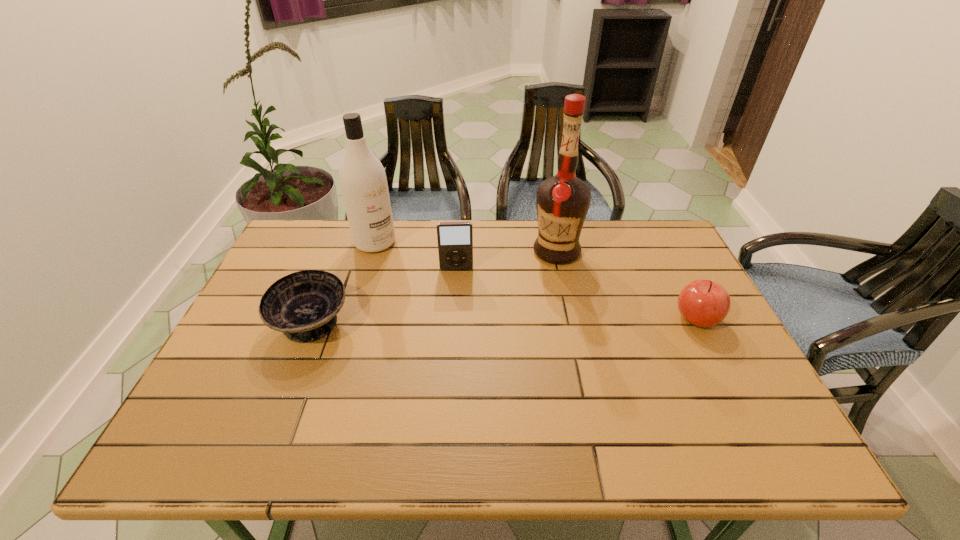
At what (x,y) coordinates should I click in order to perform the action: click on vacant region located on the front and back of the liquor. Please return your answer as a coordinate pair (x, y). The height and width of the screenshot is (540, 960). Looking at the image, I should click on (459, 323).

Identify the location of free space located 0.330m on the front and back of the liquor. This screenshot has width=960, height=540. (464, 319).

Locate an element on the screen. This screenshot has width=960, height=540. vacant space situated 0.200m on the front-facing side of the shampoo is located at coordinates (420, 286).

Where is `free space located 0.080m on the front-facing side of the shampoo`? This screenshot has height=540, width=960. free space located 0.080m on the front-facing side of the shampoo is located at coordinates (398, 265).

Identify the location of blank area located on the front-facing side of the shampoo. (421, 288).

Locate an element on the screen. free space located 0.400m on the front-facing side of the third tallest object is located at coordinates (459, 382).

Find the location of a particular element. vacant space situated 0.220m on the front-facing side of the third tallest object is located at coordinates (458, 325).

I want to click on free spot located 0.400m on the front-facing side of the third tallest object, so click(459, 382).

Find the location of `liquor at the far edge`. liquor at the far edge is located at coordinates (562, 201).

Where is `shampoo that is at the far edge`? The width and height of the screenshot is (960, 540). shampoo that is at the far edge is located at coordinates (363, 182).